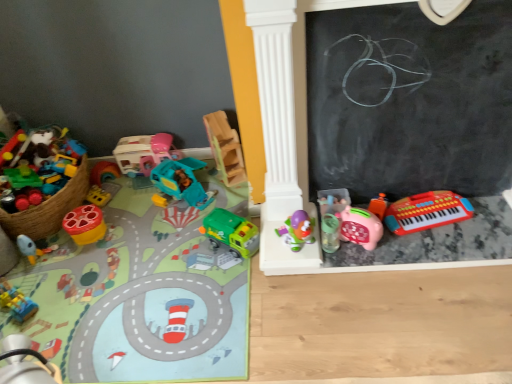
Locate an element on the screen. vacant space that is in between translucent plastic playhouse at center-left, the 5th toy viewed from the left, and plastic yellow car at lower left, arranged as the eleventh toy when viewed from the right is located at coordinates (109, 237).